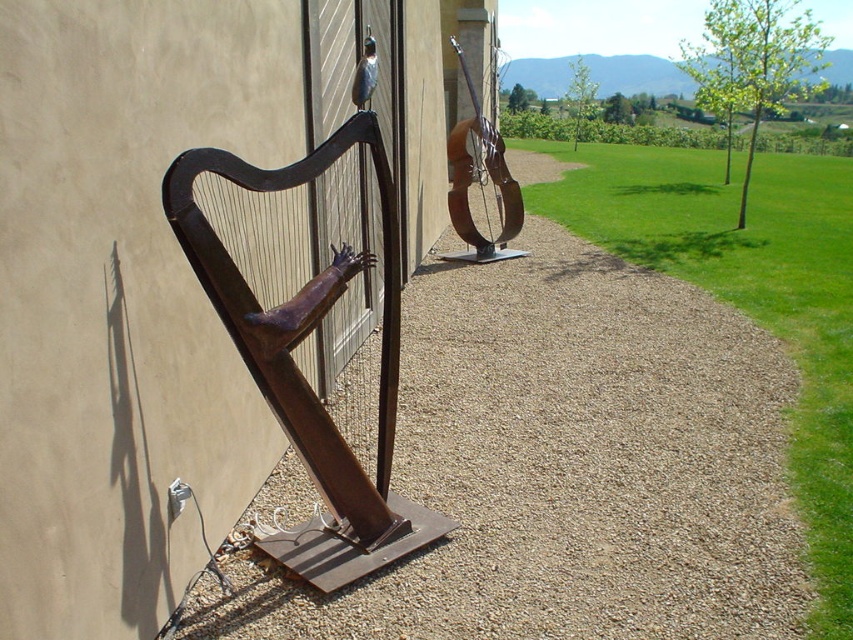
You are a maintenance worker who needs to move both the rusty metal harp at left and the rusty metal guitar at upper right to a storage facility. The storage facility has a loading dock that can only accommodate items within a 4 meter distance between them. Will you need to adjust their positions before moving them into the loading dock?

The rusty metal harp at left and the rusty metal guitar at upper right are currently 4.37 meters apart. Since the loading dock requires items to be within 4 meters, you will need to move them closer together by 0.37 meters to meet the requirement.

You are standing on the grassy area and want to walk to the rusty metal harp at left. Which direction should you move relative to the brown gravel at center?

To reach the rusty metal harp at left from the grassy area, you should move below the brown gravel at center since the brown gravel at center is located above the rusty metal harp at left.